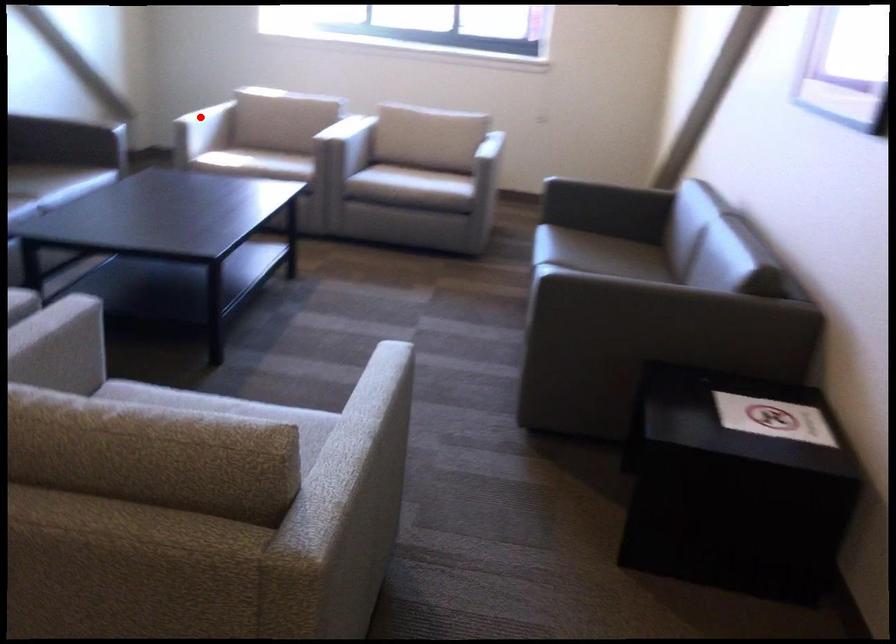
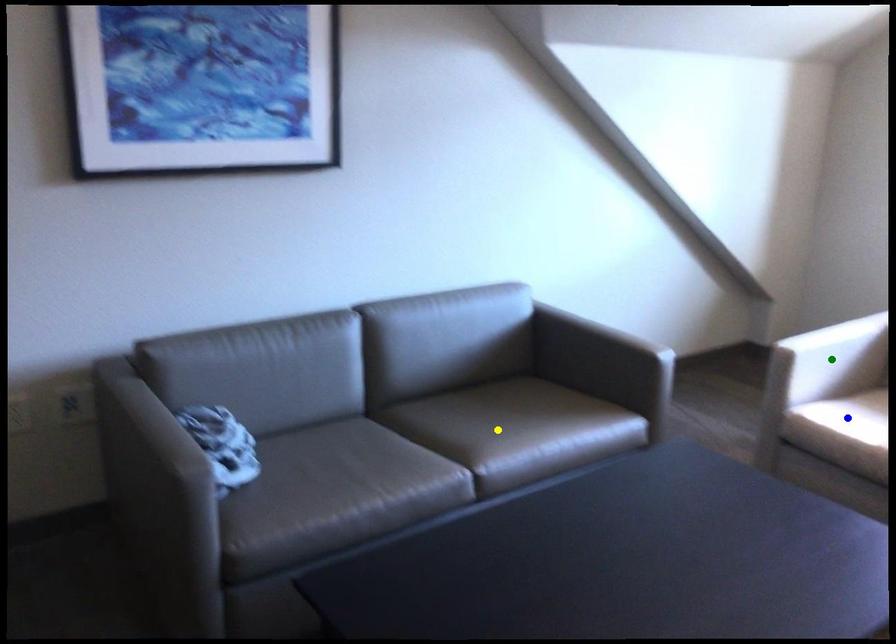
Question: I am providing you with two images of the same scene from different viewpoints. A red point is marked on the first image. You are given multiple points on the second image. Which point in image 2 is actually the same real-world point as the red point in image 1?

Choices:
 (A) blue point
 (B) yellow point
 (C) green point

Answer: (C)